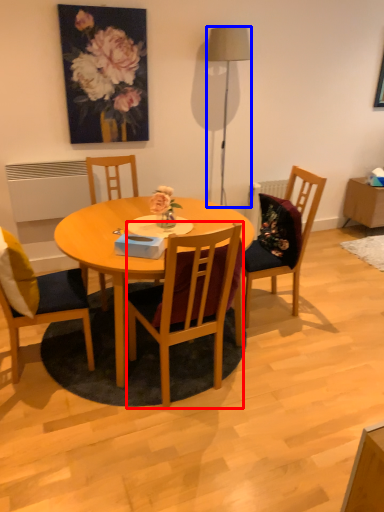
Question: Which of the following is the farthest to the observer, chair (highlighted by a red box) or lamp (highlighted by a blue box)?

Choices:
 (A) chair
 (B) lamp

Answer: (B)